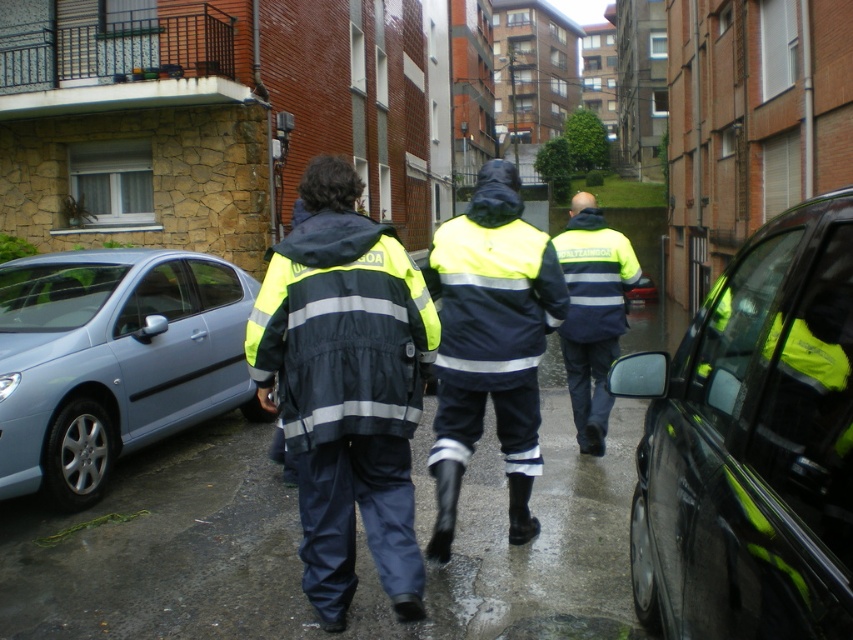
You are a pedestrian standing at the edge of the puddle in the residential area. You see the shiny black car at right and the high visibility yellow jacket at center. Which object is bigger?

The shiny black car at right is larger in size than the high visibility yellow jacket at center, so the shiny black car at right is bigger.

You are a pedestrian standing in the residential area and see the reflective yellow jacket at center and the light blue metallic car at left. Which object is closer to the right side of the image?

The reflective yellow jacket at center is to the right of the light blue metallic car at left, so it is closer to the right side of the image.

You are a pedestrian standing at the intersection and see the light blue metallic car at left and the high visibility yellow jacket at center. Which object is closer to the ground?

The light blue metallic car at left is below the high visibility yellow jacket at center, so it is closer to the ground.